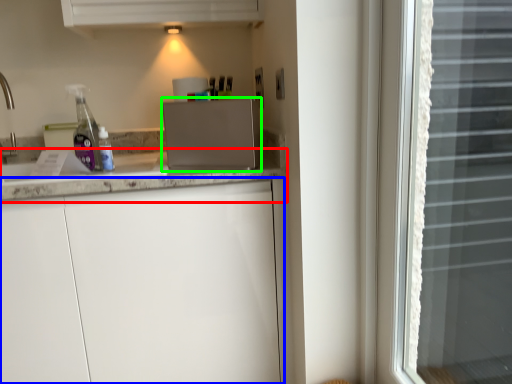
Question: Which object is positioned closest to countertop (highlighted by a red box)? Select from cabinetry (highlighted by a blue box) and appliance (highlighted by a green box).

Choices:
 (A) cabinetry
 (B) appliance

Answer: (B)